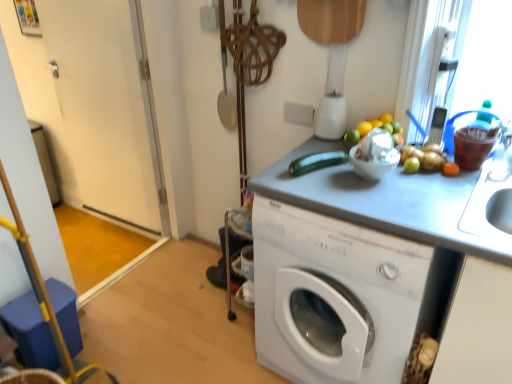
Question: Can you confirm if white glossy washing machine at center is thinner than green matte zucchini at center?

Choices:
 (A) yes
 (B) no

Answer: (B)

Question: Is white glossy washing machine at center further to camera compared to green matte zucchini at center?

Choices:
 (A) no
 (B) yes

Answer: (A)

Question: Is there a large distance between white glossy washing machine at center and green matte zucchini at center?

Choices:
 (A) yes
 (B) no

Answer: (B)

Question: Is white glossy washing machine at center closer to camera compared to green matte zucchini at center?

Choices:
 (A) no
 (B) yes

Answer: (B)

Question: From a real-world perspective, is white glossy washing machine at center located beneath green matte zucchini at center?

Choices:
 (A) no
 (B) yes

Answer: (B)

Question: Does white glossy washing machine at center have a lesser height compared to green matte zucchini at center?

Choices:
 (A) yes
 (B) no

Answer: (B)

Question: Could you tell me if white plastic blender at upper center is turned towards white glossy door at left?

Choices:
 (A) no
 (B) yes

Answer: (A)

Question: From a real-world perspective, does white plastic blender at upper center sit lower than white glossy door at left?

Choices:
 (A) yes
 (B) no

Answer: (B)

Question: Is white plastic blender at upper center at the right side of white glossy door at left?

Choices:
 (A) no
 (B) yes

Answer: (B)

Question: Considering the relative sizes of white plastic blender at upper center and white glossy door at left in the image provided, is white plastic blender at upper center bigger than white glossy door at left?

Choices:
 (A) no
 (B) yes

Answer: (A)

Question: Is white glossy door at left inside white plastic blender at upper center?

Choices:
 (A) yes
 (B) no

Answer: (B)

Question: Can you confirm if white plastic blender at upper center is positioned to the left of white glossy door at left?

Choices:
 (A) yes
 (B) no

Answer: (B)

Question: Does white glossy door at left have a larger size compared to green matte zucchini at center?

Choices:
 (A) no
 (B) yes

Answer: (B)